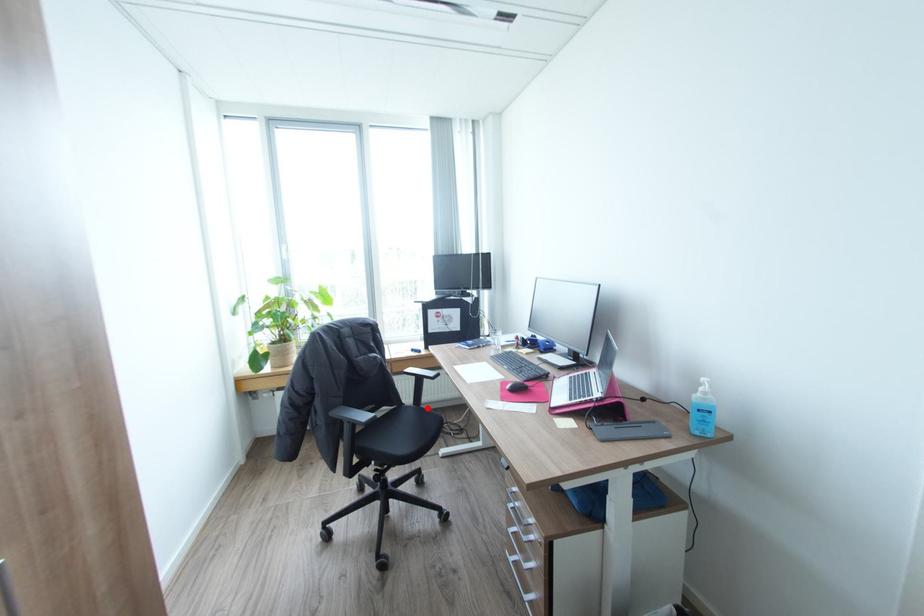
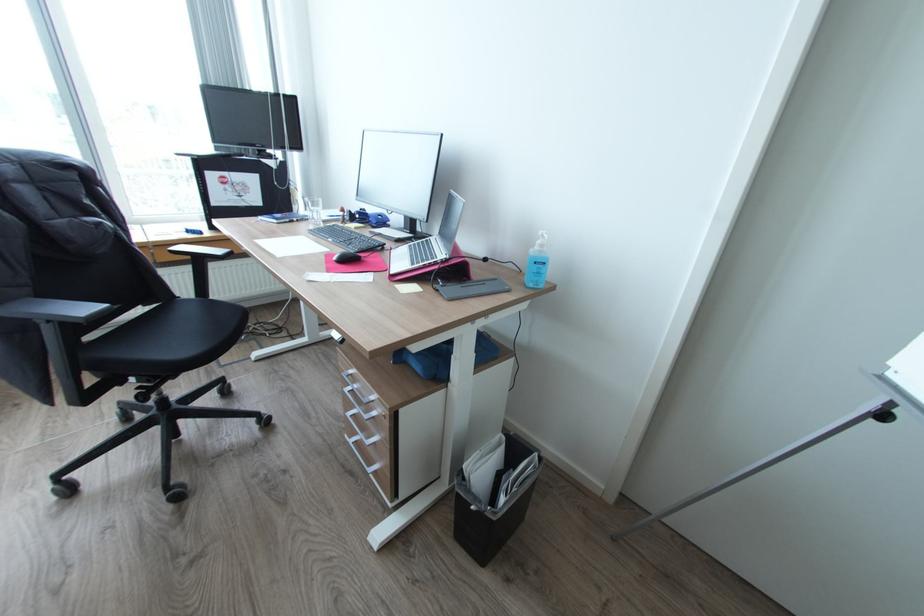
Question: A red point is marked in image1. In image2, is the corresponding 3D point closer to the camera or farther? Reply with the corresponding letter.

Choices:
 (A) The corresponding 3D point is closer.
 (B) The corresponding 3D point is farther.

Answer: (A)